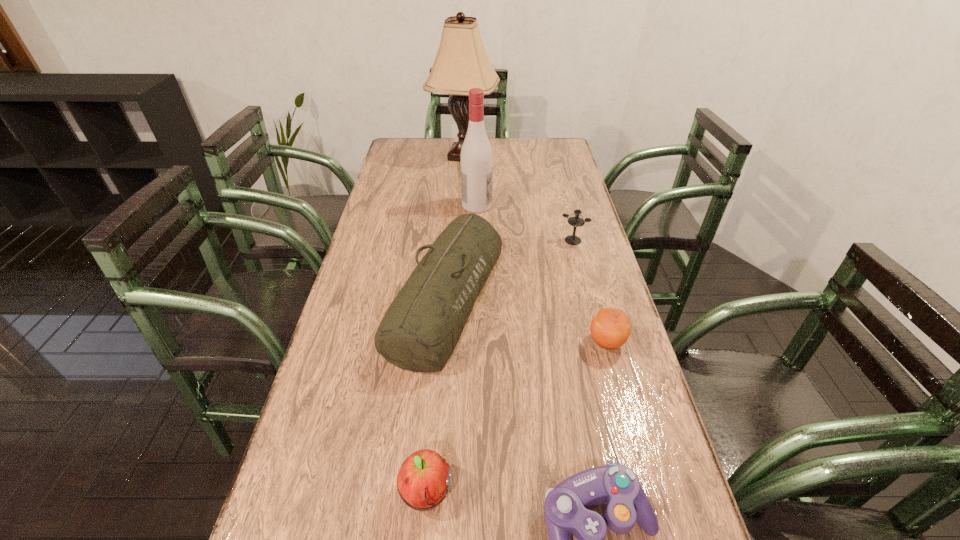
Locate an element on the screen. free location that satisfies the following two spatial constraints: 1. on the front side of the orange; 2. on the right side of the tallest object is located at coordinates (453, 342).